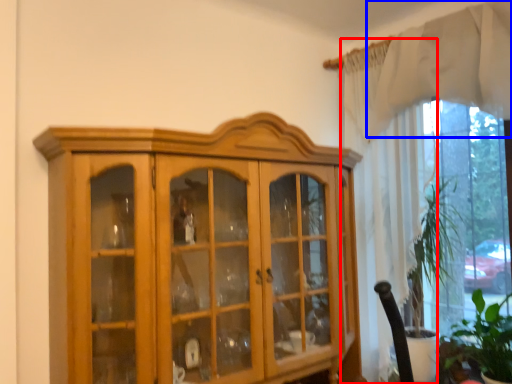
Question: Which object appears closest to the camera in this image, curtain (highlighted by a red box) or curtain (highlighted by a blue box)?

Choices:
 (A) curtain
 (B) curtain

Answer: (B)